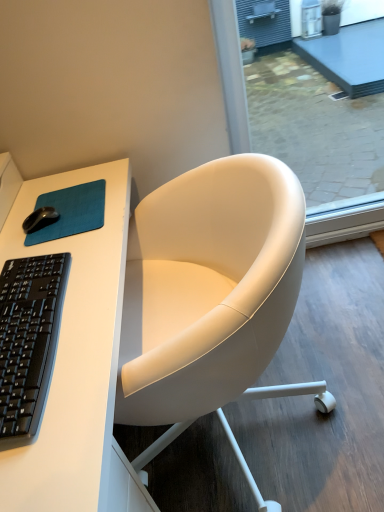
Identify the location of white leather chair at center. (210, 295).

Describe the element at coordinates (231, 72) in the screenshot. This screenshot has width=384, height=512. I see `transparent glass screen door at upper right` at that location.

What do you see at coordinates (40, 219) in the screenshot?
I see `black matte mouse at left` at bounding box center [40, 219].

What do you see at coordinates (28, 341) in the screenshot?
I see `black matte keyboard at left` at bounding box center [28, 341].

Measure the distance between teal fabric mousepad at upper left and camera.

teal fabric mousepad at upper left and camera are 1.00 meters apart from each other.

Locate an element on the screen. The width and height of the screenshot is (384, 512). teal fabric mousepad at upper left is located at coordinates (71, 211).

Where is `white matte desk at upper left`? The height and width of the screenshot is (512, 384). white matte desk at upper left is located at coordinates (74, 353).

Locate an element on the screen. This screenshot has height=512, width=384. white leather chair at center is located at coordinates (210, 295).

Does point (22, 226) come closer to viewer compared to point (243, 149)?

Yes, it is in front of point (243, 149).

Visually, is black matte mouse at left positioned to the left or to the right of transparent glass screen door at upper right?

From the image, it's evident that black matte mouse at left is to the left of transparent glass screen door at upper right.

Identify the location of mouse above the transparent glass screen door at upper right (from a real-world perspective). The width and height of the screenshot is (384, 512). (40, 219).

Identify the location of chair below the teal fabric mousepad at upper left (from the image's perspective). (210, 295).

Is white leather chair at center turned away from teal fabric mousepad at upper left?

No, teal fabric mousepad at upper left is not at the back of white leather chair at center.

From the image's perspective, which is below, white leather chair at center or teal fabric mousepad at upper left?

white leather chair at center, from the image's perspective.

Between black matte mouse at left and white matte desk at upper left, which one appears on the left side from the viewer's perspective?

Positioned to the left is black matte mouse at left.

Does black matte mouse at left have a greater width compared to white matte desk at upper left?

No, black matte mouse at left is not wider than white matte desk at upper left.

From the image's perspective, which is below, black matte mouse at left or white matte desk at upper left?

white matte desk at upper left, from the image's perspective.

Considering the sizes of objects black matte keyboard at left and teal fabric mousepad at upper left in the image provided, who is bigger, black matte keyboard at left or teal fabric mousepad at upper left?

With larger size is black matte keyboard at left.

Between black matte keyboard at left and teal fabric mousepad at upper left, which one is positioned in front?

black matte keyboard at left is closer to the camera.

Can you confirm if black matte keyboard at left is shorter than teal fabric mousepad at upper left?

No, black matte keyboard at left is not shorter than teal fabric mousepad at upper left.

Identify the location of computer keyboard below the teal fabric mousepad at upper left (from the image's perspective). This screenshot has height=512, width=384. (28, 341).

Which of these two, white leather chair at center or transparent glass screen door at upper right, is wider?

white leather chair at center.

Based on the photo, is white leather chair at center beside transparent glass screen door at upper right?

No, white leather chair at center is not with transparent glass screen door at upper right.

Between point (273, 305) and point (360, 234), which one is positioned behind?

Point (360, 234)

Is white leather chair at center situated inside transparent glass screen door at upper right or outside?

white leather chair at center is spatially situated outside transparent glass screen door at upper right.

Can you confirm if teal fabric mousepad at upper left is thinner than white leather chair at center?

Indeed, teal fabric mousepad at upper left has a lesser width compared to white leather chair at center.

Is teal fabric mousepad at upper left bigger or smaller than white leather chair at center?

In the image, teal fabric mousepad at upper left appears to be smaller than white leather chair at center.

Does teal fabric mousepad at upper left appear on the right side of white leather chair at center?

No.

From the image's perspective, is teal fabric mousepad at upper left above white leather chair at center?

Correct, teal fabric mousepad at upper left appears higher than white leather chair at center in the image.

Between black matte mouse at left and white leather chair at center, which one appears on the right side from the viewer's perspective?

Positioned to the right is white leather chair at center.

In the image, there is a white leather chair at center. Where is `mouse above it (from the image's perspective)`? The height and width of the screenshot is (512, 384). mouse above it (from the image's perspective) is located at coordinates (40, 219).

Is white leather chair at center at the back of black matte mouse at left?

black matte mouse at left does not have its back to white leather chair at center.

Where is `mouse that is on the left side of transparent glass screen door at upper right`? mouse that is on the left side of transparent glass screen door at upper right is located at coordinates (40, 219).

The height and width of the screenshot is (512, 384). In order to click on chair on the right of teal fabric mousepad at upper left in this screenshot , I will do `click(210, 295)`.

Considering their positions, is white matte desk at upper left positioned further to white leather chair at center than teal fabric mousepad at upper left?

teal fabric mousepad at upper left lies further to white leather chair at center than the other object.

When comparing their distances from black matte mouse at left, does white matte desk at upper left or white leather chair at center seem closer?

white matte desk at upper left is closer to black matte mouse at left.

Estimate the real-world distances between objects in this image. Which object is further from white matte desk at upper left, black matte mouse at left or teal fabric mousepad at upper left?

Among the two, black matte mouse at left is located further to white matte desk at upper left.

Looking at the image, which one is located closer to black matte mouse at left, white leather chair at center or transparent glass screen door at upper right?

white leather chair at center is positioned closer to the anchor black matte mouse at left.

Based on their spatial positions, is black matte keyboard at left or black matte mouse at left closer to white matte desk at upper left?

black matte keyboard at left.

Looking at the image, which one is located further to transparent glass screen door at upper right, black matte mouse at left or black matte keyboard at left?

black matte keyboard at left is positioned further to the anchor transparent glass screen door at upper right.

Estimate the real-world distances between objects in this image. Which object is closer to black matte mouse at left, transparent glass screen door at upper right or white matte desk at upper left?

white matte desk at upper left is closer to black matte mouse at left.

Looking at the image, which one is located further to white leather chair at center, black matte keyboard at left or white matte desk at upper left?

Based on the image, black matte keyboard at left appears to be further to white leather chair at center.

Where is `mousepad situated between white matte desk at upper left and white leather chair at center from left to right`? The image size is (384, 512). mousepad situated between white matte desk at upper left and white leather chair at center from left to right is located at coordinates (71, 211).

The height and width of the screenshot is (512, 384). I want to click on computer keyboard situated between teal fabric mousepad at upper left and white leather chair at center from left to right, so click(x=28, y=341).

Identify the location of mousepad between black matte mouse at left and white leather chair at center. (71, 211).

At what (x,y) coordinates should I click in order to perform the action: click on desk situated between black matte mouse at left and transparent glass screen door at upper right from left to right. Please return your answer as a coordinate pair (x, y). Looking at the image, I should click on (74, 353).